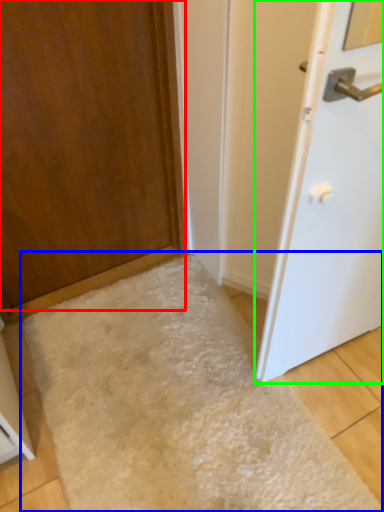
Question: Which object is the closest to the door (highlighted by a red box)? Choose among these: flour (highlighted by a blue box) or door (highlighted by a green box).

Choices:
 (A) flour
 (B) door

Answer: (A)